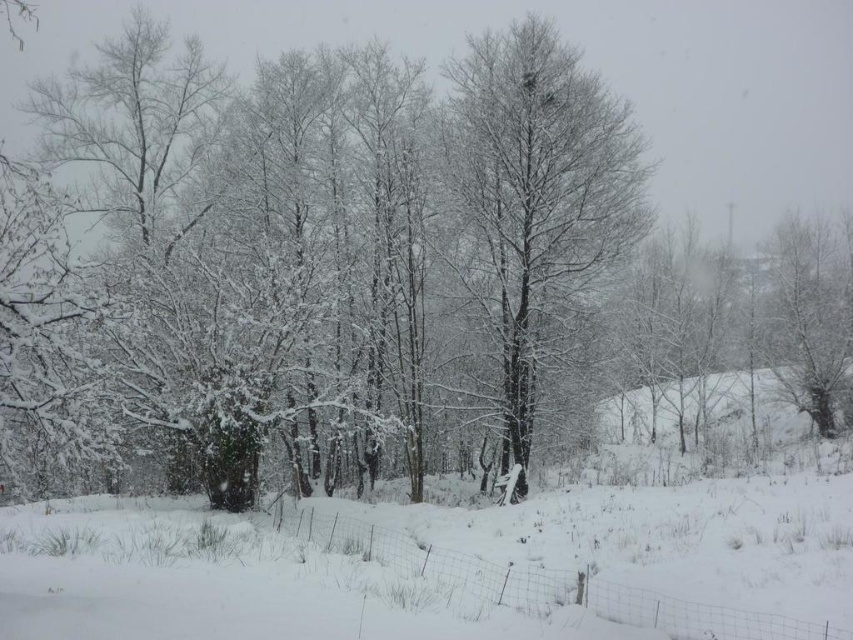
Question: Which of the following is the closest to the observer?

Choices:
 (A) (486, 392)
 (B) (711, 483)

Answer: (B)

Question: Which point is farther to the camera?

Choices:
 (A) white fluffy snow at center
 (B) snow-covered tree at center

Answer: (B)

Question: Can you confirm if white fluffy snow at center is positioned to the left of snow-covered tree at center?

Choices:
 (A) yes
 (B) no

Answer: (B)

Question: Considering the relative positions of white fluffy snow at center and snow-covered tree at center in the image provided, where is white fluffy snow at center located with respect to snow-covered tree at center?

Choices:
 (A) below
 (B) above

Answer: (A)

Question: Is white fluffy snow at center closer to the viewer compared to snow-covered tree at center?

Choices:
 (A) yes
 (B) no

Answer: (A)